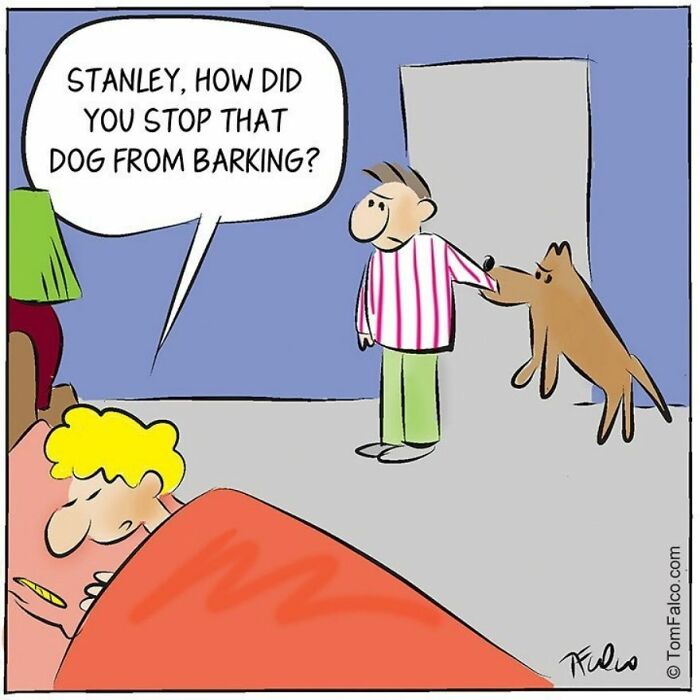
At what (x,y) coordinates should I click in order to perform the action: click on green lampshade. Please return your answer as a coordinate pair (x, y). Looking at the image, I should click on (31, 257).